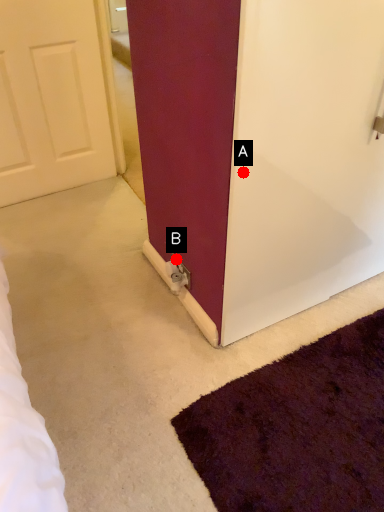
Question: Two points are circled on the image, labeled by A and B beside each circle. Which point appears farthest from the camera in this image?

Choices:
 (A) A is further
 (B) B is further

Answer: (B)